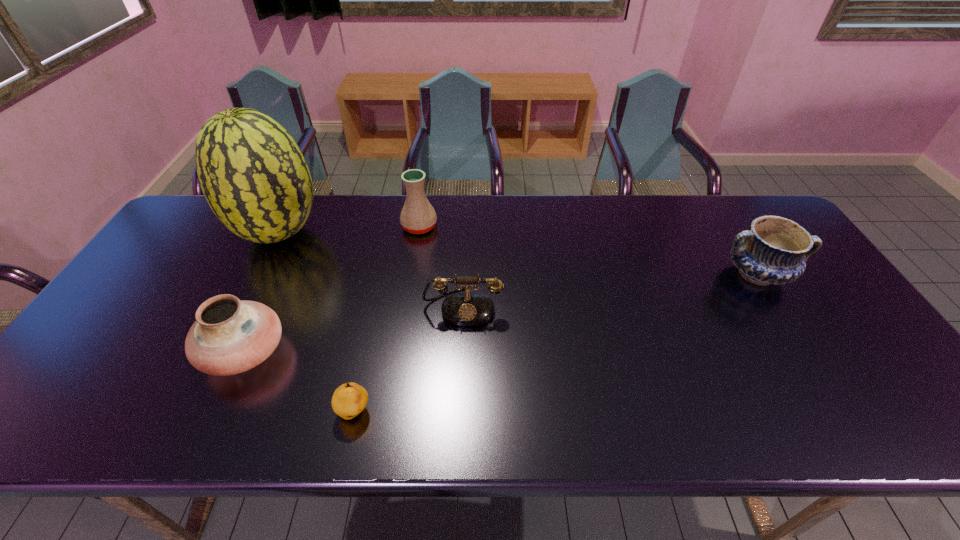
You are a GUI agent. You are given a task and a screenshot of the screen. Output one action in this format:
    pyautogui.click(x=<x>, y=<y>)
    Task: Click on the free location located on the left of the tallest pottery
    
    Given the screenshot: What is the action you would take?
    pyautogui.click(x=286, y=227)

Identify the location of vacant space located on the front of the second farthest pottery. (803, 346).

Identify the location of vacant space located 0.190m on the back of the leftmost pottery. (282, 269).

Where is `vacant region located on the dial of the telephone`? vacant region located on the dial of the telephone is located at coordinates (459, 419).

Identify the location of vacant region located on the right of the nearest object. The height and width of the screenshot is (540, 960). (431, 411).

Locate an element on the screen. The image size is (960, 540). watermelon at the far edge is located at coordinates (253, 175).

Locate an element on the screen. This screenshot has width=960, height=540. pottery that is at the far edge is located at coordinates (418, 216).

The height and width of the screenshot is (540, 960). Identify the location of object present at the near edge. (349, 400).

You are a GUI agent. You are given a task and a screenshot of the screen. Output one action in this format:
    pyautogui.click(x=<x>, y=<y>)
    Task: Click on the object located in the right edge section of the desktop
    
    Given the screenshot: What is the action you would take?
    pyautogui.click(x=774, y=251)

I want to click on vacant space at the far edge of the desktop, so click(x=707, y=197).